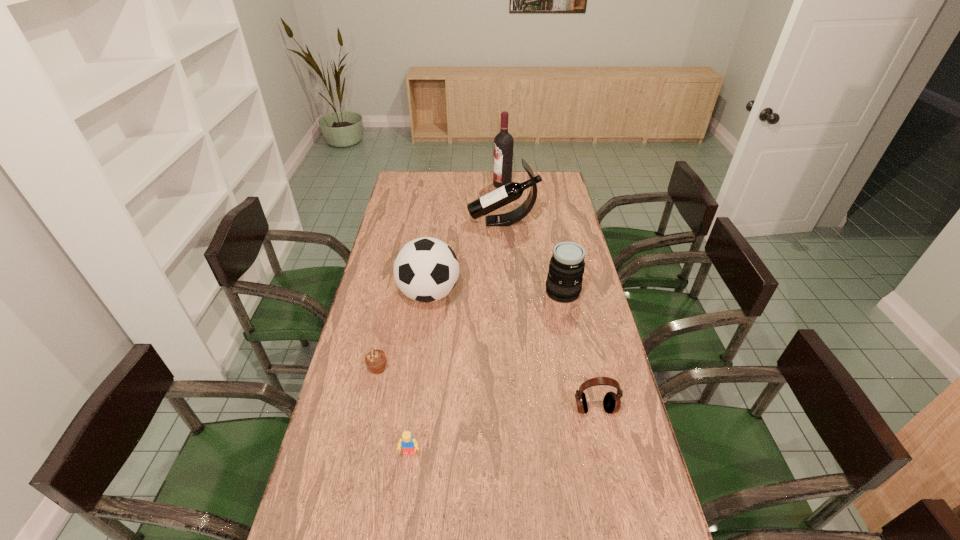
In the image, there is a desktop. At what (x,y) coordinates should I click in order to perform the action: click on free space at the far right corner. Please return your answer as a coordinate pair (x, y). This screenshot has height=540, width=960. Looking at the image, I should click on (561, 176).

In order to click on free area in between the fifth tallest object and the tallest object in this screenshot , I will do `click(548, 296)`.

This screenshot has width=960, height=540. In order to click on free space between the muffin and the second nearest object in this screenshot , I will do `click(487, 389)`.

What are the coordinates of `free space between the sixth shortest object and the telephoto lens` in the screenshot? It's located at (533, 257).

What are the coordinates of `blank region between the nearest object and the fifth tallest object` in the screenshot? It's located at (502, 431).

Where is `vacant area between the third nearest object and the nearest object`? vacant area between the third nearest object and the nearest object is located at coordinates (394, 411).

Locate an element on the screen. The height and width of the screenshot is (540, 960). vacant area that lies between the sixth farthest object and the taller wine bottle is located at coordinates (548, 296).

Locate an element on the screen. The height and width of the screenshot is (540, 960). free spot between the second farthest object and the Lego is located at coordinates (456, 338).

At what (x,y) coordinates should I click in order to perform the action: click on vacant point located between the shorter wine bottle and the nearest object. Please return your answer as a coordinate pair (x, y). This screenshot has height=540, width=960. Looking at the image, I should click on (456, 338).

Point out which object is positioned as the third nearest to the taller wine bottle. Please provide its 2D coordinates. Your answer should be formatted as a tuple, i.e. [(x, y)], where the tuple contains the x and y coordinates of a point satisfying the conditions above.

[(564, 280)]